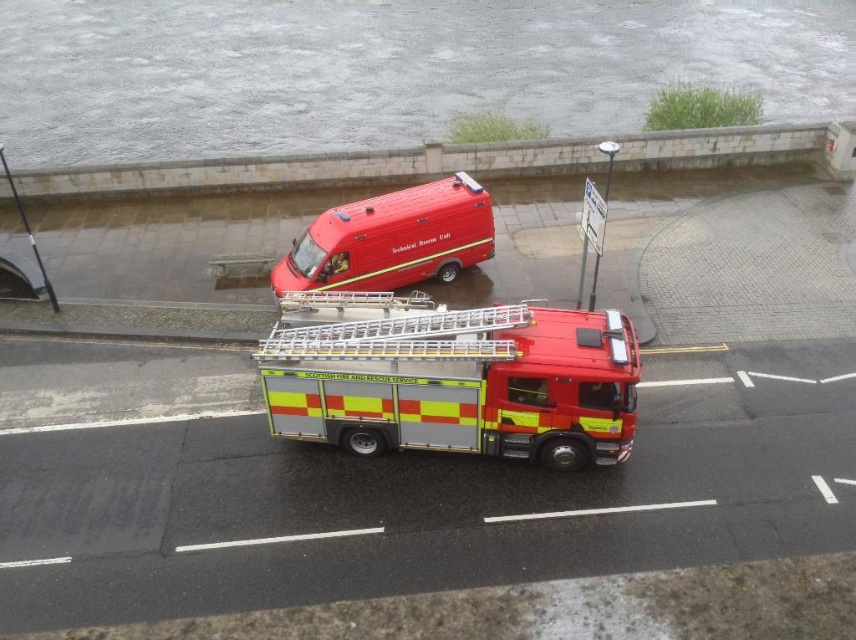
This screenshot has width=856, height=640. What do you see at coordinates (388, 68) in the screenshot?
I see `gray concrete flood at upper center` at bounding box center [388, 68].

Is point (849, 100) positioned after point (488, 211)?

Yes, point (849, 100) is behind point (488, 211).

Locate an element on the screen. The height and width of the screenshot is (640, 856). gray concrete flood at upper center is located at coordinates (388, 68).

Who is more forward, (7,100) or (560,339)?

Positioned in front is point (560,339).

Does gray concrete flood at upper center have a lesser height compared to metallic red fire truck at center?

Incorrect, gray concrete flood at upper center's height does not fall short of metallic red fire truck at center's.

Where is `gray concrete flood at upper center`? gray concrete flood at upper center is located at coordinates (388, 68).

Is point (337, 156) positioned after point (310, 257)?

Yes, point (337, 156) is farther from viewer.

Can you confirm if white stone curb at upper center is positioned to the left of matte red van at center?

In fact, white stone curb at upper center is to the right of matte red van at center.

The height and width of the screenshot is (640, 856). Identify the location of white stone curb at upper center. (310, 170).